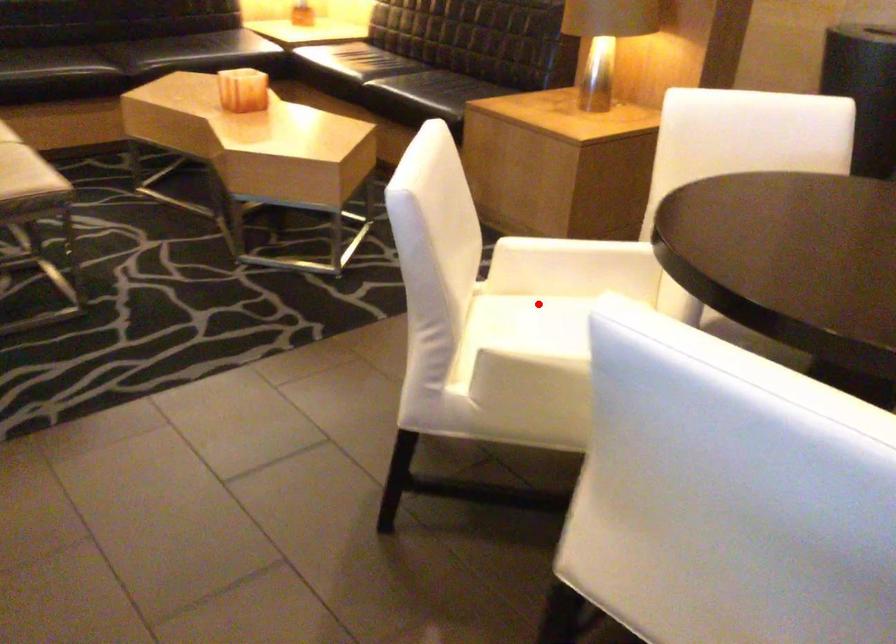
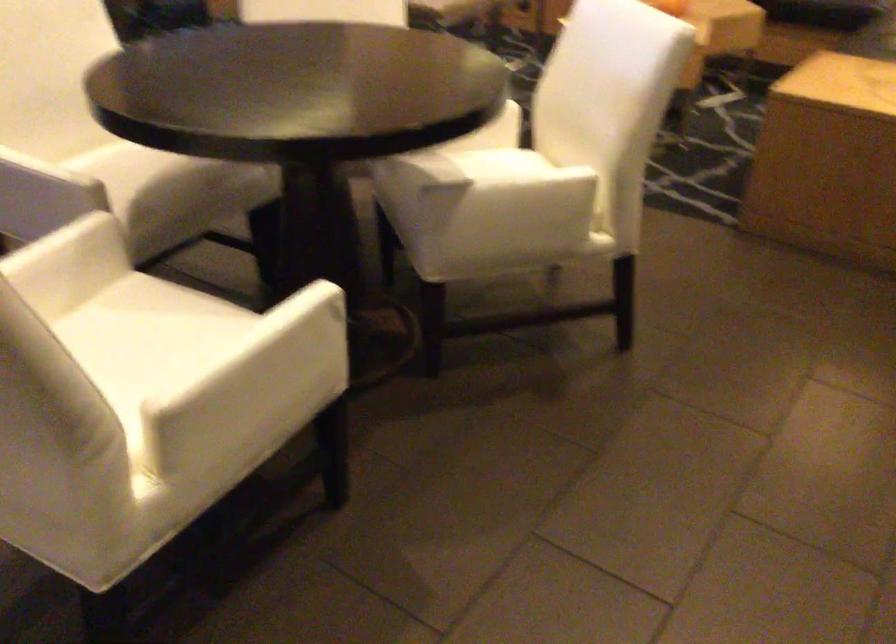
Question: I am providing you with two images of the same scene from different viewpoints. A red point is marked on the first image. Can you still see the location of the red point in image 2?

Choices:
 (A) Yes
 (B) No

Answer: (B)